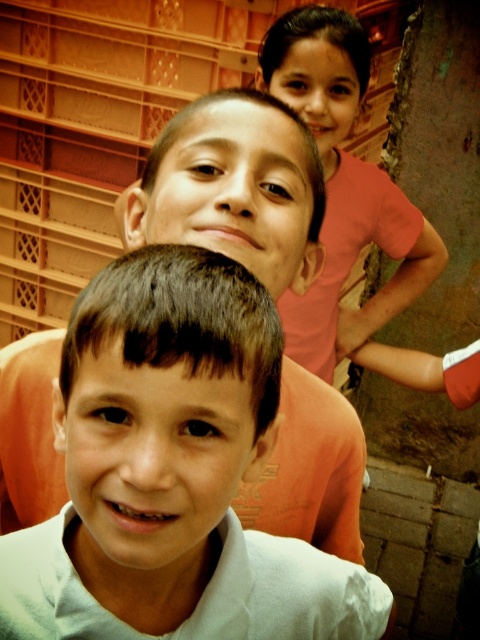
Question: Which object is farther from the camera taking this photo?

Choices:
 (A) pink cotton shirt at upper right
 (B) light gray cotton shirt at center

Answer: (A)

Question: Observing the image, what is the correct spatial positioning of light gray cotton shirt at center in reference to pink cotton shirt at upper right?

Choices:
 (A) right
 (B) left

Answer: (B)

Question: Is light gray cotton shirt at center above pink cotton shirt at upper right?

Choices:
 (A) no
 (B) yes

Answer: (A)

Question: Is light gray cotton shirt at center to the left of pink cotton shirt at upper right from the viewer's perspective?

Choices:
 (A) no
 (B) yes

Answer: (B)

Question: Which point is farther from the camera taking this photo?

Choices:
 (A) (79, 588)
 (B) (416, 232)

Answer: (B)